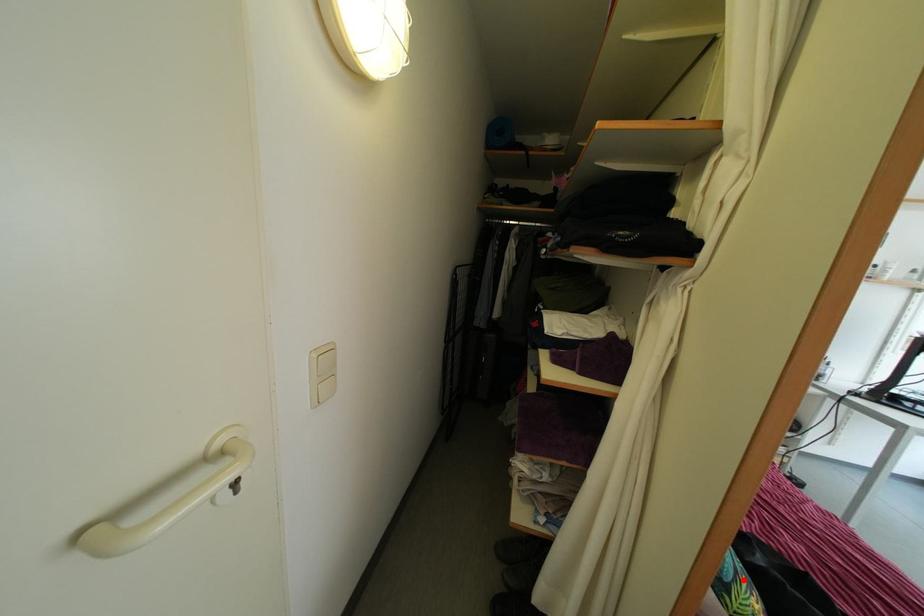
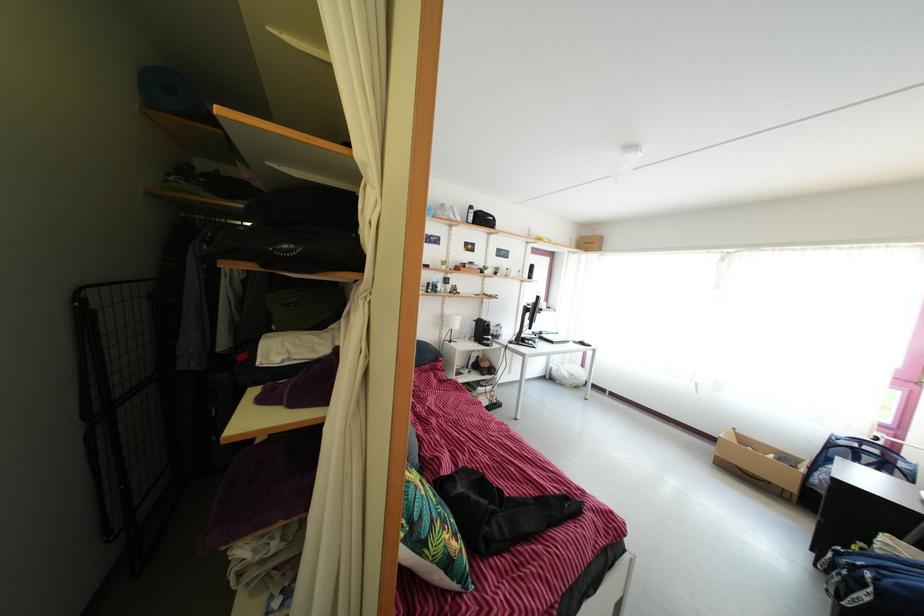
Question: I am providing you with two images of the same scene from different viewpoints. A red point is shown in image1. For the corresponding object point in image2, is it positioned nearer or farther from the camera?

Choices:
 (A) Nearer
 (B) Farther

Answer: (B)